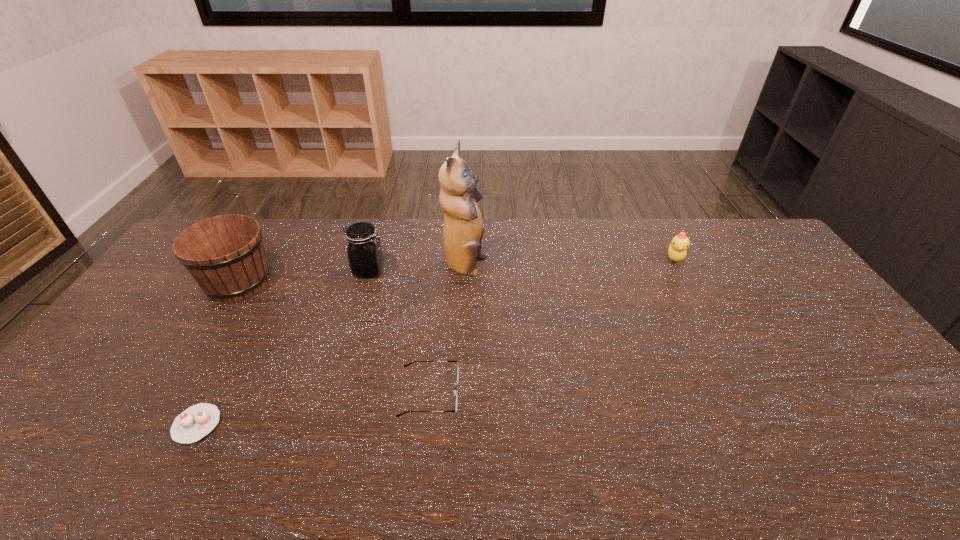
Locate an element on the screen. The height and width of the screenshot is (540, 960). vacant space at the right edge is located at coordinates (788, 299).

At what (x,y) coordinates should I click in order to perform the action: click on free spot at the near left corner of the desktop. Please return your answer as a coordinate pair (x, y). Looking at the image, I should click on (58, 465).

This screenshot has height=540, width=960. In order to click on free space between the wine bucket and the fourth object from right to left in this screenshot , I will do `click(303, 276)`.

Locate an element on the screen. The width and height of the screenshot is (960, 540). empty space between the shortest object and the jar is located at coordinates (283, 348).

At what (x,y) coordinates should I click in order to perform the action: click on vacant area that lies between the second shortest object and the wine bucket. Please return your answer as a coordinate pair (x, y). This screenshot has width=960, height=540. Looking at the image, I should click on (334, 338).

Where is `free area in between the cupcake and the duckling`? The image size is (960, 540). free area in between the cupcake and the duckling is located at coordinates (436, 341).

At what (x,y) coordinates should I click in order to perform the action: click on vacant area between the fourth object from right to left and the third shortest object. Please return your answer as a coordinate pair (x, y). Looking at the image, I should click on (521, 265).

Locate an element on the screen. The height and width of the screenshot is (540, 960). free space between the tallest object and the third shortest object is located at coordinates (569, 262).

I want to click on vacant space in between the shortest object and the cat, so click(x=331, y=346).

Identify the location of vacant area between the third object from left to right and the second shortest object. (399, 332).